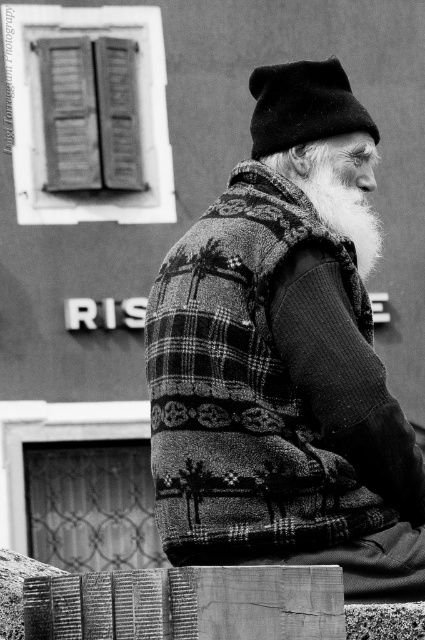
Question: Is plaid wool vest at center below white woolen beard at upper right?

Choices:
 (A) no
 (B) yes

Answer: (B)

Question: Which point is farther to the camera?

Choices:
 (A) (220, 524)
 (B) (314, 104)
 (C) (353, 161)

Answer: (C)

Question: Among these objects, which one is nearest to the camera?

Choices:
 (A) plaid wool vest at center
 (B) white woolen beard at upper right
 (C) black woolen hat at upper center

Answer: (A)

Question: Can you confirm if plaid wool vest at center is smaller than black woolen hat at upper center?

Choices:
 (A) yes
 (B) no

Answer: (B)

Question: In this image, where is plaid wool vest at center located relative to white woolen beard at upper right?

Choices:
 (A) left
 (B) right

Answer: (A)

Question: Based on their relative distances, which object is farther from the white woolen beard at upper right?

Choices:
 (A) black woolen hat at upper center
 (B) plaid wool vest at center

Answer: (B)